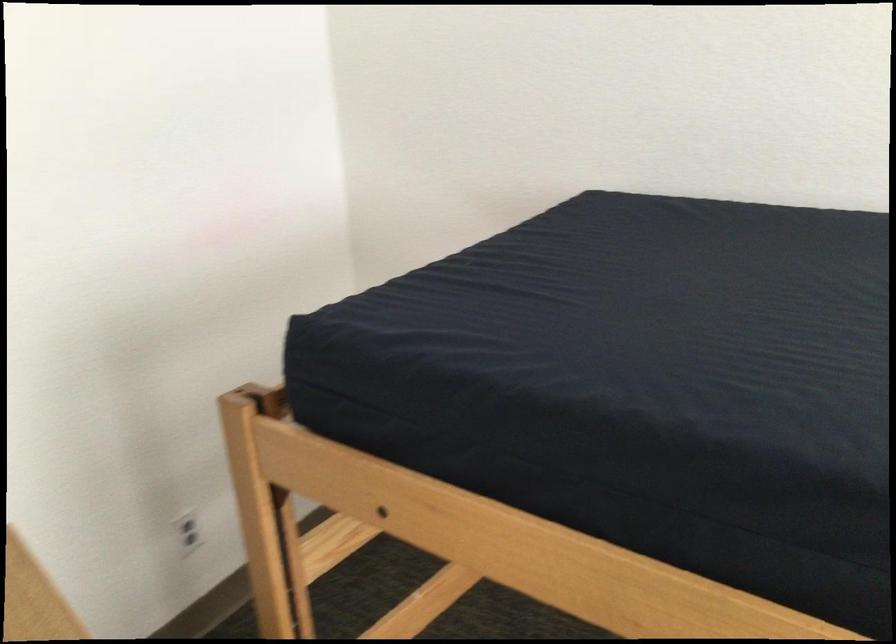
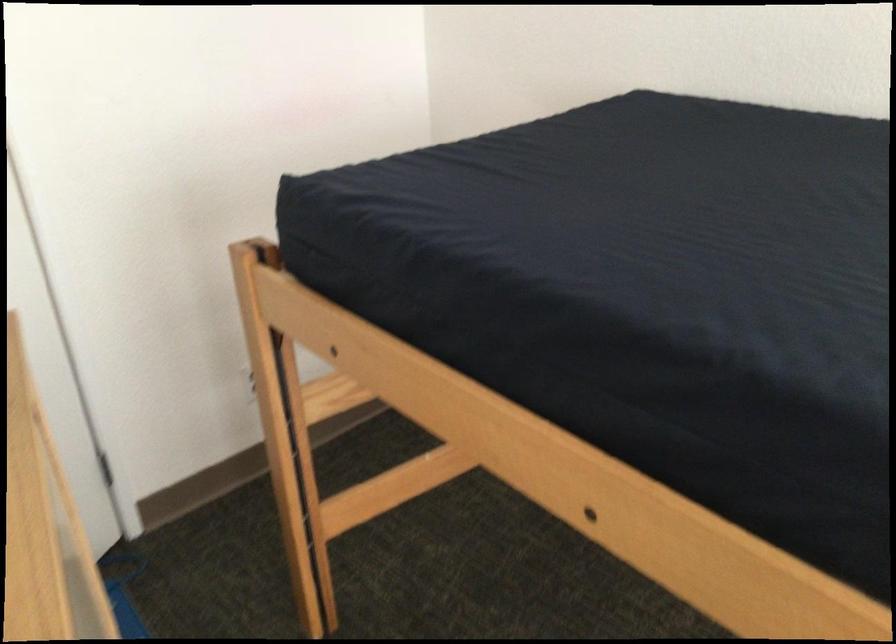
Where in the second image is the point corresponding to pixel 259 399 from the first image?

(262, 251)